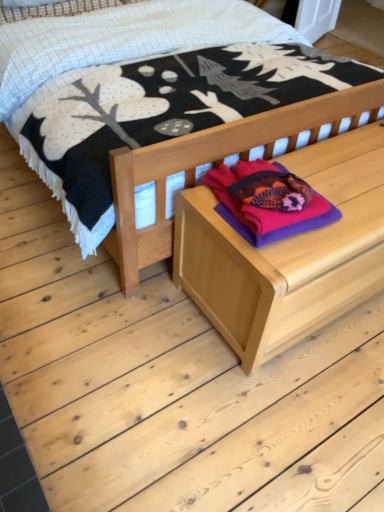
The height and width of the screenshot is (512, 384). Identify the location of vacant space to the right of purple fleece sweater at center. click(x=347, y=196).